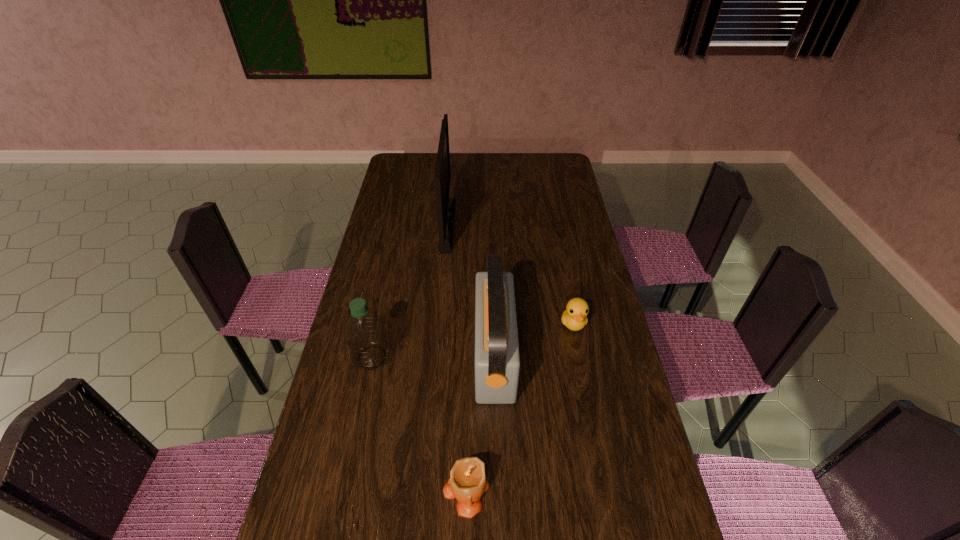
At what (x,y) coordinates should I click in order to perform the action: click on vacant area situated 0.060m on the front-facing side of the radio receiver. Please return your answer as a coordinate pair (x, y). The width and height of the screenshot is (960, 540). Looking at the image, I should click on (456, 355).

You are a GUI agent. You are given a task and a screenshot of the screen. Output one action in this format:
    pyautogui.click(x=<x>, y=<y>)
    Task: Click on the free region located 0.290m on the front of the leftmost object
    
    Given the screenshot: What is the action you would take?
    pyautogui.click(x=348, y=474)

The height and width of the screenshot is (540, 960). What are the coordinates of `blank space located 0.110m on the right of the nearest object` in the screenshot? It's located at (536, 490).

At what (x,y) coordinates should I click in order to perform the action: click on free space located 0.290m on the face of the rightmost object. Please return your answer as a coordinate pair (x, y). This screenshot has height=540, width=960. Looking at the image, I should click on (593, 423).

At what (x,y) coordinates should I click in order to perform the action: click on object at the left edge. Please return your answer as a coordinate pair (x, y). This screenshot has height=540, width=960. Looking at the image, I should click on (364, 330).

Image resolution: width=960 pixels, height=540 pixels. In order to click on object at the right edge in this screenshot , I will do `click(574, 317)`.

Locate an element on the screen. vacant space at the far edge of the desktop is located at coordinates coord(455,165).

The image size is (960, 540). Identify the location of blank area at the left edge. 400,179.

The height and width of the screenshot is (540, 960). I want to click on vacant space at the right edge, so click(591, 380).

Where is `free space at the far left corner of the desktop`? The width and height of the screenshot is (960, 540). free space at the far left corner of the desktop is located at coordinates (395, 156).